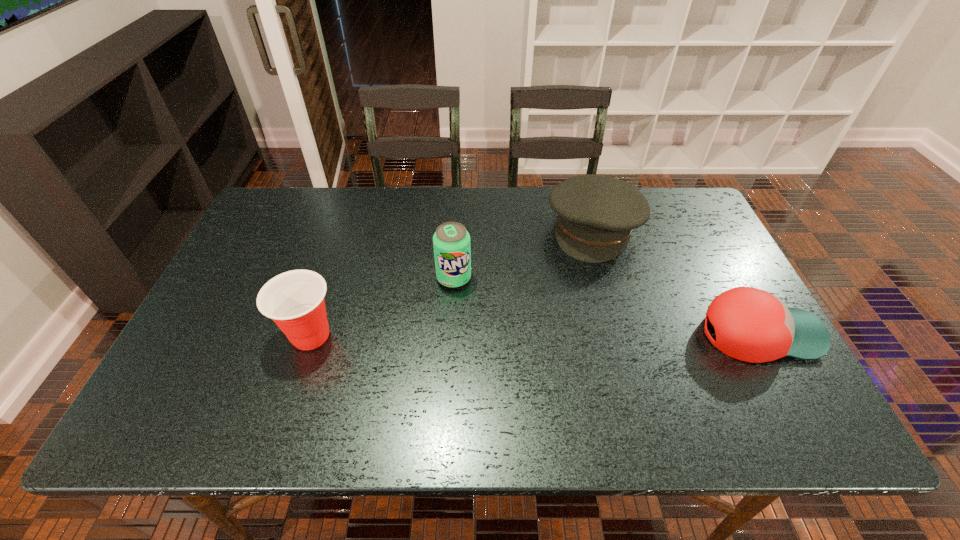
The image size is (960, 540). In order to click on free spot on the desktop that is between the leftmost object and the shortest object and is positioned on the front-facing side of the pop soda in this screenshot , I will do `click(480, 335)`.

Find the location of a particular element. The height and width of the screenshot is (540, 960). free space on the desktop that is between the cup and the baseball cap and is positioned on the front-facing side of the farthest object is located at coordinates (562, 334).